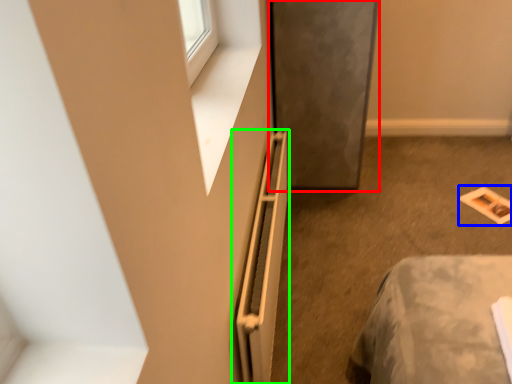
Question: Based on their relative distances, which object is nearer to screen door (highlighted by a red box)? Choose from magazine (highlighted by a blue box) and radiator (highlighted by a green box).

Choices:
 (A) magazine
 (B) radiator

Answer: (B)